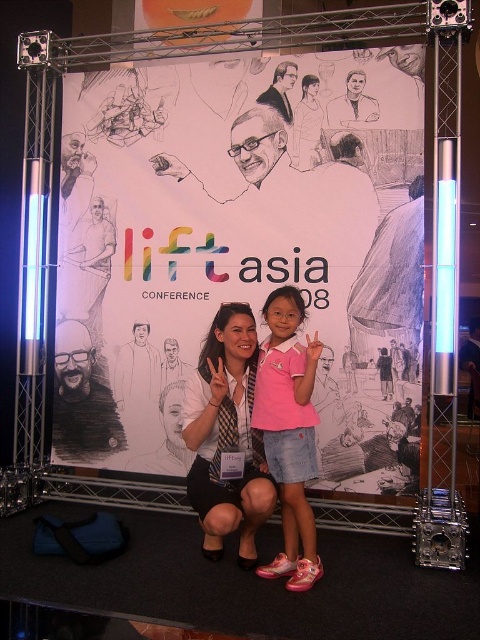
You are a photographer at the Lift Asia Conference 2008. You need to capture a photo of the two people wearing the matte black blazer at center and the pink matte shirt at center. According to the scene, which one is positioned to the left?

The matte black blazer at center is positioned to the left of the pink matte shirt at center.

You are standing in front of the Lift Asia Conference 2008 banner and notice two points marked on the truss structure. The first point is at coordinates point (250,362) and the second is at point (314,360). Which point is closer to you?

Point (250,362) is further to the camera than point (314,360), so the point closer to you is point (314,360).

You are attending the Lift Asia Conference 2008 and notice two attendees wearing a matte black blazer at center and a pink matte shirt at center. If you look directly at the banner, which clothing item is positioned lower?

The matte black blazer at center is positioned lower than the pink matte shirt at center.